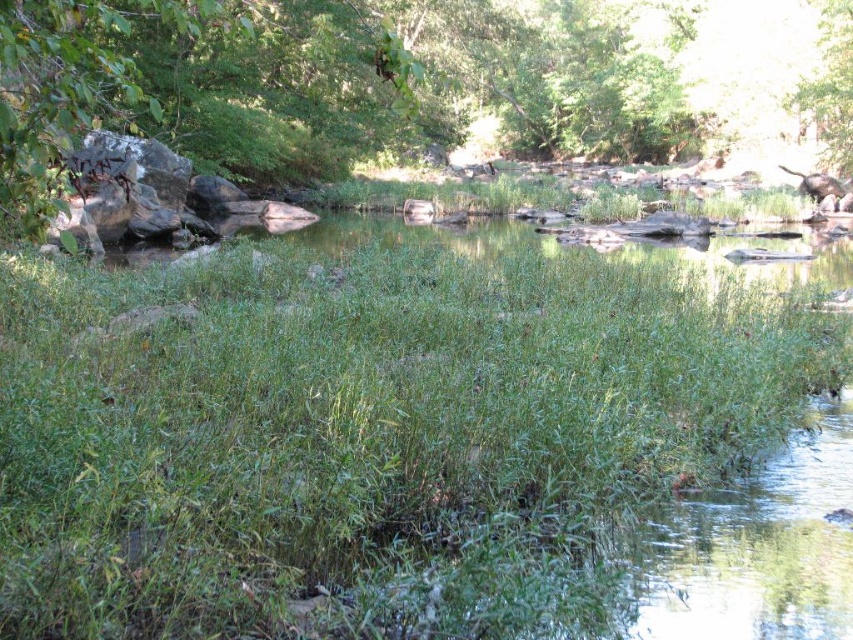
You are standing at the edge of the water and want to take a photo of the green leafy grass at center and the green leafy tree at upper right. Which object will appear closer to you in the photo?

The green leafy grass at center will appear closer to you in the photo because it is positioned in front of the green leafy tree at upper right.

You are planning to install a small floating dock between the green leafy tree at upper left and the green leafy tree at upper right. The dock requires a minimum of 6 meters of space to be safely anchored. Based on the scene description, will the available space between the two trees be sufficient for this dock?

The distance between the green leafy tree at upper left and the green leafy tree at upper right is 7.25 meters, which exceeds the required 6 meters. Therefore, the available space is sufficient for the dock.